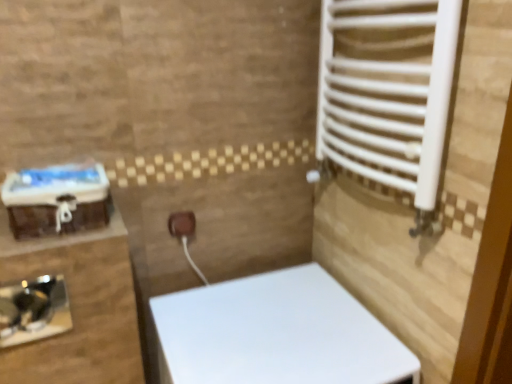
Question: Is black glossy sink at lower left at the back of brown matte electric outlet at center?

Choices:
 (A) yes
 (B) no

Answer: (B)

Question: Is brown matte electric outlet at center behind black glossy sink at lower left?

Choices:
 (A) yes
 (B) no

Answer: (A)

Question: Does brown matte electric outlet at center have a greater width compared to black glossy sink at lower left?

Choices:
 (A) yes
 (B) no

Answer: (A)

Question: Is brown matte electric outlet at center closer to the viewer compared to black glossy sink at lower left?

Choices:
 (A) yes
 (B) no

Answer: (B)

Question: Does brown matte electric outlet at center have a lesser width compared to black glossy sink at lower left?

Choices:
 (A) no
 (B) yes

Answer: (A)

Question: Considering the positions of black glossy sink at lower left and white glossy toilet at center in the image, is black glossy sink at lower left wider or thinner than white glossy toilet at center?

Choices:
 (A) thin
 (B) wide

Answer: (A)

Question: Do you think black glossy sink at lower left is within white glossy toilet at center, or outside of it?

Choices:
 (A) inside
 (B) outside

Answer: (B)

Question: From their relative heights in the image, would you say black glossy sink at lower left is taller or shorter than white glossy toilet at center?

Choices:
 (A) tall
 (B) short

Answer: (B)

Question: Considering the positions of point (15, 317) and point (203, 354), is point (15, 317) closer or farther from the camera than point (203, 354)?

Choices:
 (A) farther
 (B) closer

Answer: (B)

Question: In the image, is white glossy toilet at center on the left side or the right side of black glossy sink at lower left?

Choices:
 (A) left
 (B) right

Answer: (B)

Question: From a real-world perspective, is white glossy toilet at center above or below black glossy sink at lower left?

Choices:
 (A) above
 (B) below

Answer: (B)

Question: From the image's perspective, relative to black glossy sink at lower left, is white glossy toilet at center above or below?

Choices:
 (A) above
 (B) below

Answer: (B)

Question: In the image, is white glossy toilet at center positioned in front of or behind black glossy sink at lower left?

Choices:
 (A) behind
 (B) front

Answer: (B)

Question: In terms of width, does white glossy toilet at center look wider or thinner when compared to brown matte electric outlet at center?

Choices:
 (A) wide
 (B) thin

Answer: (A)

Question: Is white glossy toilet at center situated inside brown matte electric outlet at center or outside?

Choices:
 (A) inside
 (B) outside

Answer: (B)